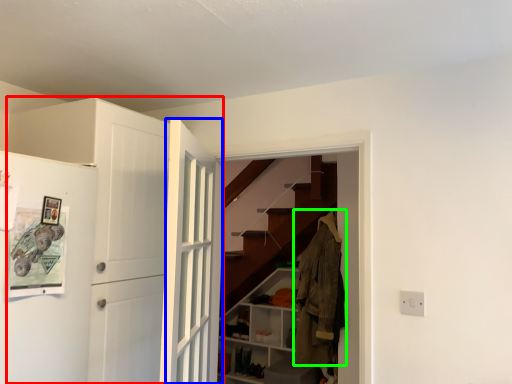
Question: Considering the real-world distances, which object is farthest from door (highlighted by a red box)? door (highlighted by a blue box) or clothing (highlighted by a green box)?

Choices:
 (A) door
 (B) clothing

Answer: (B)